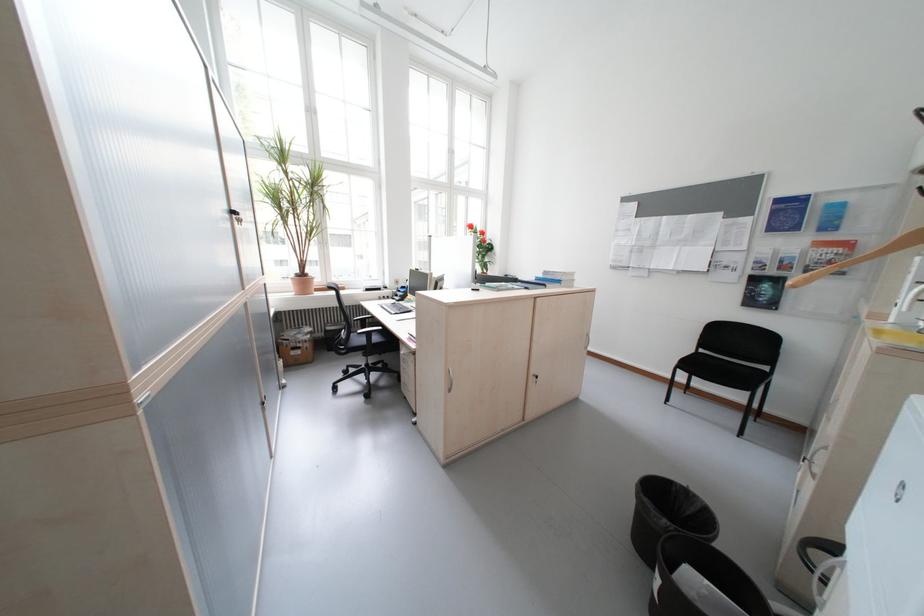
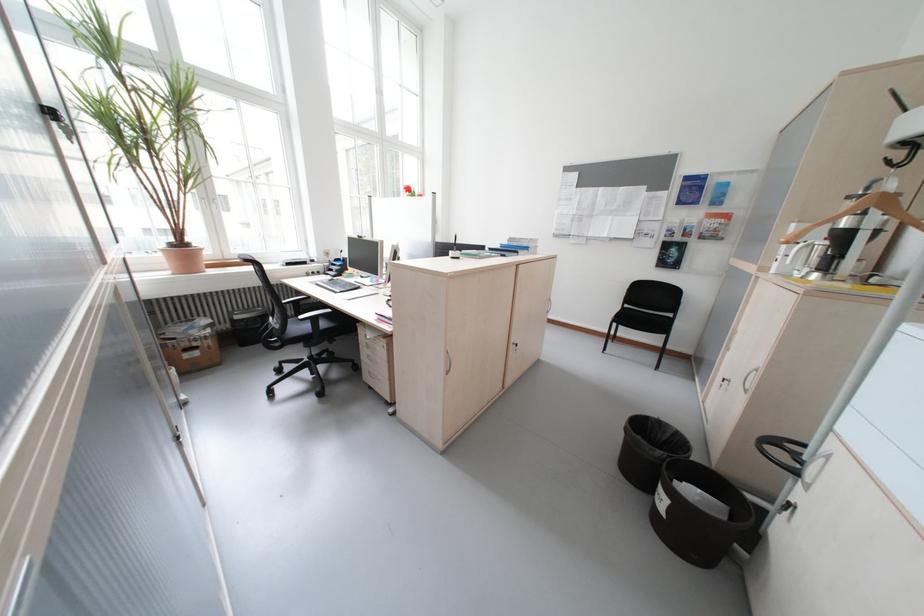
Question: The camera is either moving clockwise (left) or counter-clockwise (right) around the object. The first image is from the beginning of the video and the second image is from the end. Is the camera moving left or right when shooting the video?

Choices:
 (A) Left
 (B) Right

Answer: (A)